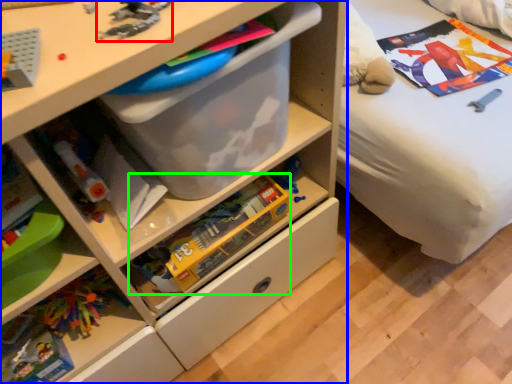
Question: Which object is positioned farthest from toy (highlighted by a red box)? Select from chest of drawers (highlighted by a blue box) and toy (highlighted by a green box).

Choices:
 (A) chest of drawers
 (B) toy

Answer: (B)